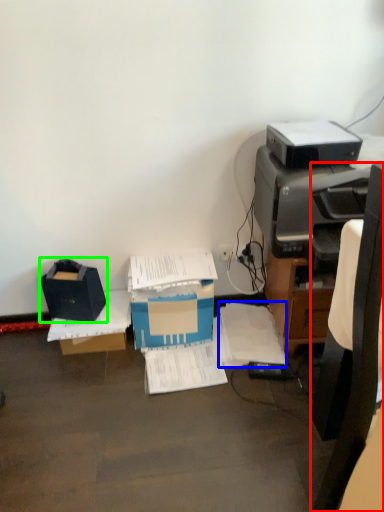
Question: Which object is the closest to the chair (highlighted by a red box)? Choose among these: document (highlighted by a blue box) or storage box (highlighted by a green box).

Choices:
 (A) document
 (B) storage box

Answer: (A)